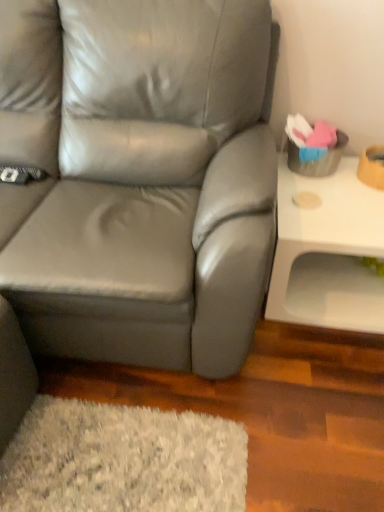
Question: Considering the positions of matte gray leather couch at center and white glossy table at right in the image, is matte gray leather couch at center wider or thinner than white glossy table at right?

Choices:
 (A) thin
 (B) wide

Answer: (B)

Question: From the image's perspective, is matte gray leather couch at center positioned above or below white glossy table at right?

Choices:
 (A) below
 (B) above

Answer: (B)

Question: Is matte gray leather couch at center to the left or to the right of white glossy table at right in the image?

Choices:
 (A) left
 (B) right

Answer: (A)

Question: From a real-world perspective, is white glossy table at right positioned above or below matte gray leather couch at center?

Choices:
 (A) below
 (B) above

Answer: (A)

Question: In terms of size, does white glossy table at right appear bigger or smaller than matte gray leather couch at center?

Choices:
 (A) big
 (B) small

Answer: (B)

Question: From their relative heights in the image, would you say white glossy table at right is taller or shorter than matte gray leather couch at center?

Choices:
 (A) short
 (B) tall

Answer: (A)

Question: Is point (269, 306) closer or farther from the camera than point (99, 31)?

Choices:
 (A) farther
 (B) closer

Answer: (A)